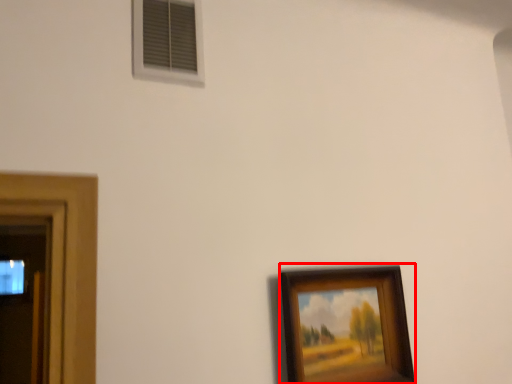
Question: From the image's perspective, where is picture frame (annotated by the red box) located relative to window?

Choices:
 (A) below
 (B) above

Answer: (A)